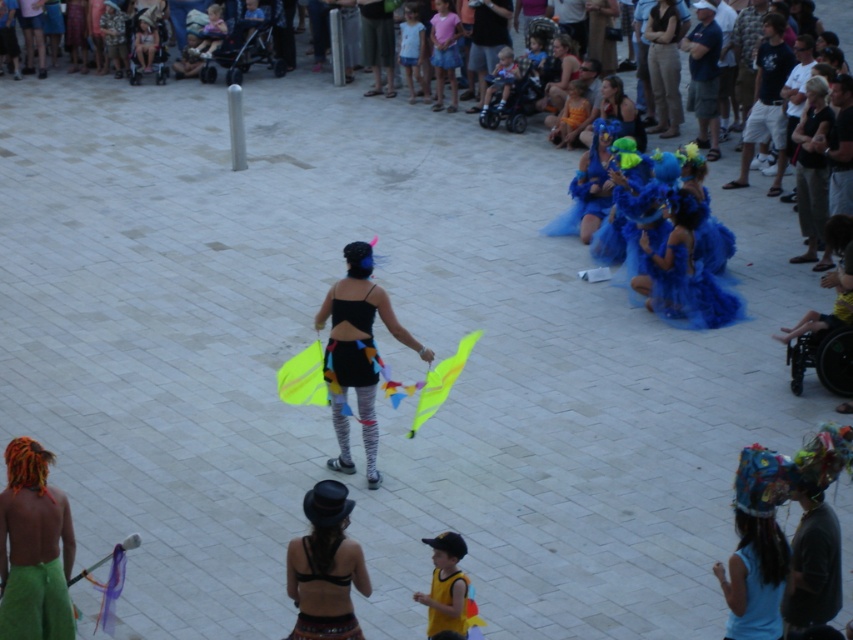
You are a photographer trying to capture both the black fabric skirt at center and the blue fabric dress at center in a single shot. Based on their positions, which one is closer to the camera?

The black fabric skirt at center is closer to the camera because the blue fabric dress at center is behind it.

You are a photographer standing at the edge of the plaza, and you want to take a photo of the blue fabric stroller at center and the fuzzy blue dress at center right. If your camera can focus on objects within a 5 meter range, will both subjects be in focus?

The fuzzy blue dress at center right is 8.06 meters from the blue fabric stroller at center, so the distance between them is greater than the camera focus range of 5 meters. Therefore, both subjects cannot be in focus simultaneously.